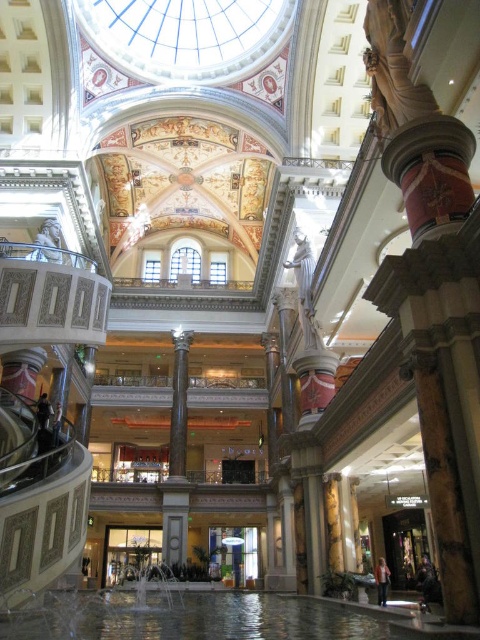
You are a maintenance worker in the mall and need to move a large equipment that is 100 feet long. You see the black marble column at center and the white marble statue at center. Can you fit the equipment between them?

The distance between the black marble column at center and the white marble statue at center is 112.81 feet, so the equipment that is 100 feet long can be placed between them since it is shorter than the available space.